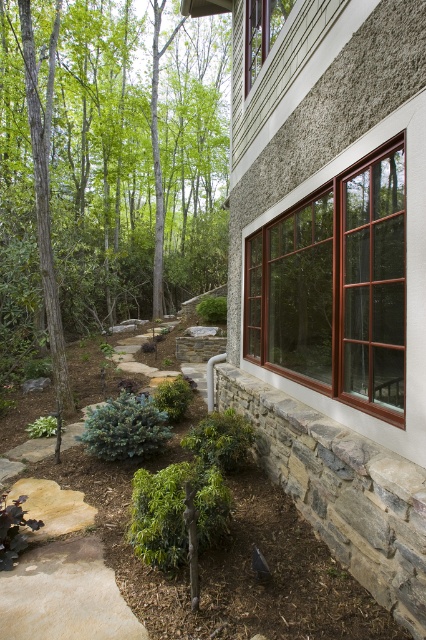
Question: Which point appears farthest from the camera in this image?

Choices:
 (A) (112, 74)
 (B) (388, 147)

Answer: (A)

Question: Does green leafy tree at upper left appear under brown glass window at center right?

Choices:
 (A) yes
 (B) no

Answer: (B)

Question: From the image, what is the correct spatial relationship of green leafy tree at upper left in relation to brown glass window at center right?

Choices:
 (A) right
 (B) left

Answer: (B)

Question: Can you confirm if green leafy tree at upper left is positioned below brown glass window at center right?

Choices:
 (A) yes
 (B) no

Answer: (B)